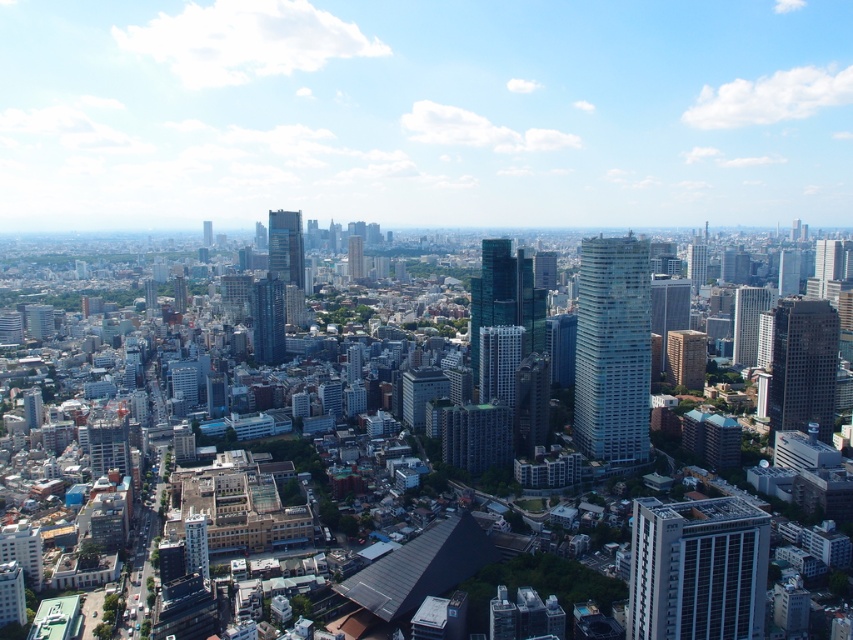
Who is lower down, glassy blue skyscraper at center-right or green glass skyscraper at center?

glassy blue skyscraper at center-right is below.

Is glassy blue skyscraper at center-right bigger than green glass skyscraper at center?

Indeed, glassy blue skyscraper at center-right has a larger size compared to green glass skyscraper at center.

Is point (595, 248) farther from viewer compared to point (358, 236)?

No, (595, 248) is in front of (358, 236).

You are a GUI agent. You are given a task and a screenshot of the screen. Output one action in this format:
    pyautogui.click(x=<x>, y=<y>)
    Task: Click on the glassy blue skyscraper at center-right
    
    Given the screenshot: What is the action you would take?
    pyautogui.click(x=612, y=352)

Which is more to the left, green glass skyscraper at center or glassy blue skyscraper at upper center?

glassy blue skyscraper at upper center

Does green glass skyscraper at center have a greater height compared to glassy blue skyscraper at upper center?

Indeed, green glass skyscraper at center has a greater height compared to glassy blue skyscraper at upper center.

I want to click on green glass skyscraper at center, so click(355, 257).

Find the location of a particular element. This screenshot has height=640, width=853. green glass skyscraper at center is located at coordinates (355, 257).

This screenshot has width=853, height=640. What do you see at coordinates (268, 320) in the screenshot?
I see `dark blue glass skyscraper at center` at bounding box center [268, 320].

Between dark blue glass skyscraper at center and glassy reflective skyscraper at center-right, which one has more height?

With more height is dark blue glass skyscraper at center.

Does point (267, 326) come farther from viewer compared to point (749, 330)?

No, it is in front of (749, 330).

The width and height of the screenshot is (853, 640). I want to click on dark blue glass skyscraper at center, so click(268, 320).